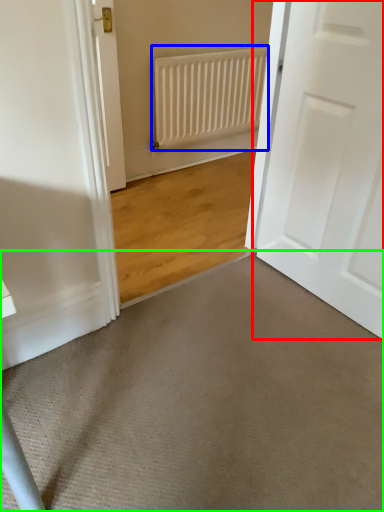
Question: Which object is the farthest from door (highlighted by a red box)? Choose among these: radiator (highlighted by a blue box) or doormat (highlighted by a green box).

Choices:
 (A) radiator
 (B) doormat

Answer: (A)